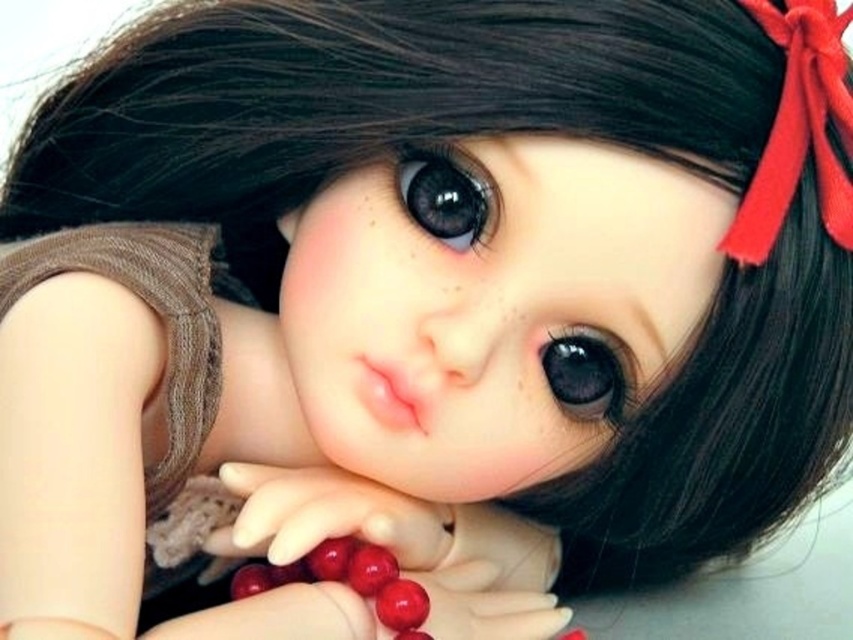
You are an artist trying to paint the beads in the image. You have a brush that can only paint objects up to 3 cm wide. The smooth plastic beads at center and the shiny red beads at center are both in your view. Can your brush handle both?

The smooth plastic beads at center might be wider than shiny red beads at center. Since the brush can only paint up to 3 cm wide, it depends on the exact width of the smooth plastic beads at center. If they are wider than 3 cm, the brush won